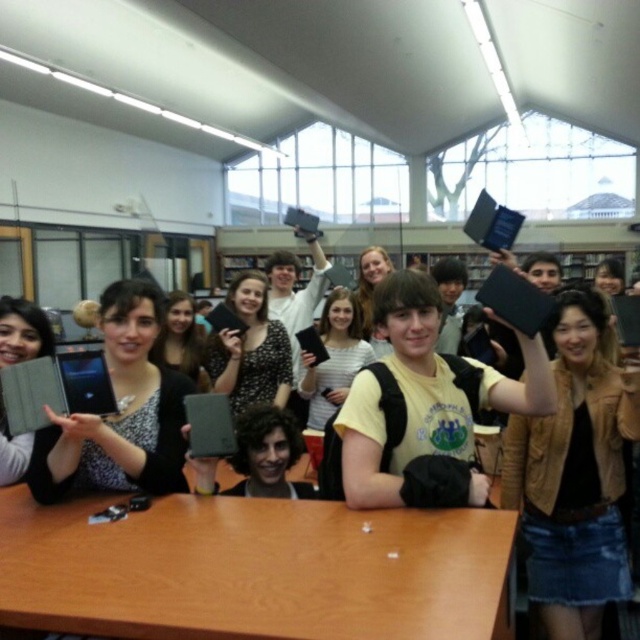
You are an observer looking at the scene. You notice the brown leather jacket at upper right and the black dotted shirt at center. Which object is located lower in the image?

The brown leather jacket at upper right is positioned under the black dotted shirt at center, so it is located lower in the image.

You are standing in the library and want to reach a specific point marked at coordinates point (532, 385). If you can move forward 5 feet, will you be able to reach it?

The distance of point (532, 385) from viewer is 5.52 feet. Since you can move forward 5 feet, you will not be able to reach it as the distance is greater than your movement capability.